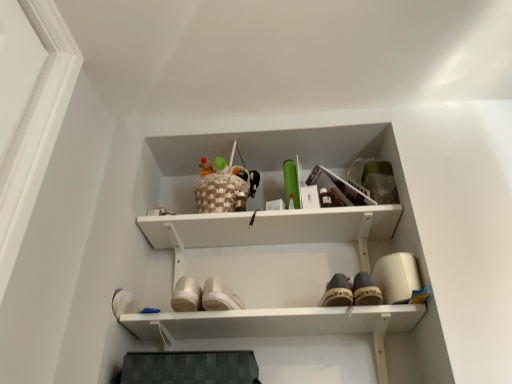
Question: Is white canvas shoe at center touching woven basket at upper center?

Choices:
 (A) no
 (B) yes

Answer: (A)

Question: Is the position of white canvas shoe at center more distant than that of woven basket at upper center?

Choices:
 (A) yes
 (B) no

Answer: (B)

Question: Can we say white canvas shoe at center lies outside woven basket at upper center?

Choices:
 (A) yes
 (B) no

Answer: (A)

Question: Is white canvas shoe at center at the right side of woven basket at upper center?

Choices:
 (A) yes
 (B) no

Answer: (A)

Question: Is there a large distance between white canvas shoe at center and woven basket at upper center?

Choices:
 (A) yes
 (B) no

Answer: (B)

Question: From the image's perspective, is white canvas shoe at center located above woven basket at upper center?

Choices:
 (A) no
 (B) yes

Answer: (A)

Question: Does woven basket at upper center appear on the right side of white canvas shoe at center?

Choices:
 (A) no
 (B) yes

Answer: (A)

Question: Is woven basket at upper center far from white canvas shoe at center?

Choices:
 (A) no
 (B) yes

Answer: (A)

Question: Could you tell me if woven basket at upper center is turned towards white canvas shoe at center?

Choices:
 (A) no
 (B) yes

Answer: (A)

Question: Does woven basket at upper center come behind white canvas shoe at center?

Choices:
 (A) no
 (B) yes

Answer: (B)

Question: Does woven basket at upper center lie in front of white canvas shoe at center?

Choices:
 (A) no
 (B) yes

Answer: (A)

Question: Does woven basket at upper center have a lesser width compared to white canvas shoe at center?

Choices:
 (A) yes
 (B) no

Answer: (A)

Question: Is woven basket at upper center inside the boundaries of white canvas shoe at center, or outside?

Choices:
 (A) outside
 (B) inside

Answer: (A)